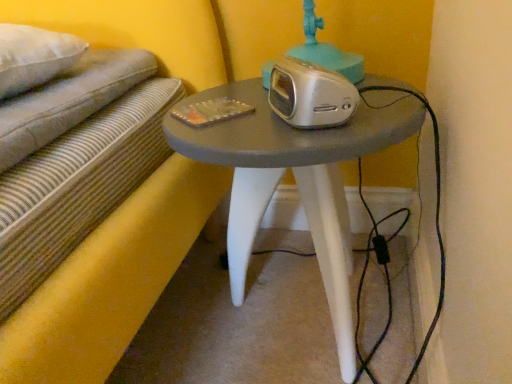
Question: Looking at their shapes, would you say matte gray table at center is wider or thinner than silver metallic alarm clock at center?

Choices:
 (A) wide
 (B) thin

Answer: (A)

Question: From the image's perspective, is matte gray table at center located above or below silver metallic alarm clock at center?

Choices:
 (A) below
 (B) above

Answer: (A)

Question: Considering the positions of matte gray table at center and silver metallic alarm clock at center in the image, is matte gray table at center bigger or smaller than silver metallic alarm clock at center?

Choices:
 (A) small
 (B) big

Answer: (B)

Question: Based on their sizes in the image, would you say silver metallic alarm clock at center is bigger or smaller than matte gray table at center?

Choices:
 (A) big
 (B) small

Answer: (B)

Question: From a real-world perspective, is silver metallic alarm clock at center physically located above or below matte gray table at center?

Choices:
 (A) below
 (B) above

Answer: (B)

Question: Which is correct: silver metallic alarm clock at center is inside matte gray table at center, or outside of it?

Choices:
 (A) outside
 (B) inside

Answer: (A)

Question: Is silver metallic alarm clock at center wider or thinner than matte gray table at center?

Choices:
 (A) wide
 (B) thin

Answer: (B)